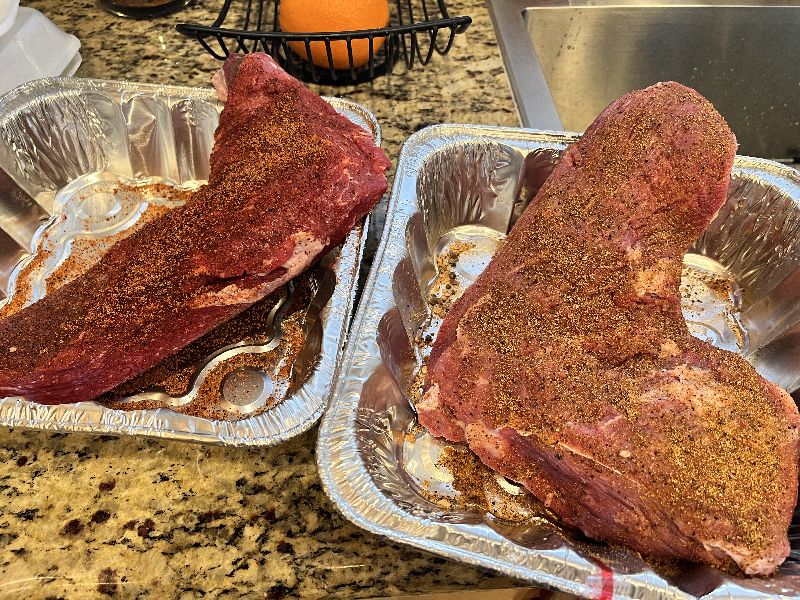
The height and width of the screenshot is (600, 800). I want to click on granite countertop, so click(x=194, y=530), click(x=474, y=68).